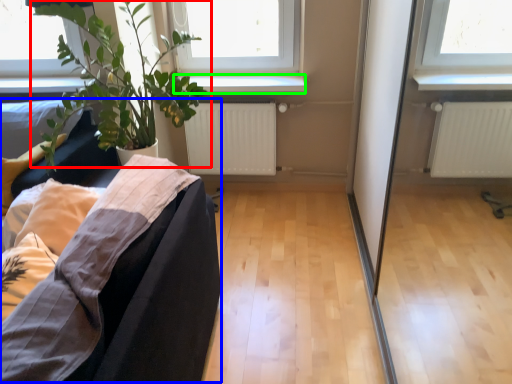
Question: Which object is positioned closest to houseplant (highlighted by a red box)? Select from couch (highlighted by a blue box) and window sill (highlighted by a green box).

Choices:
 (A) couch
 (B) window sill

Answer: (B)